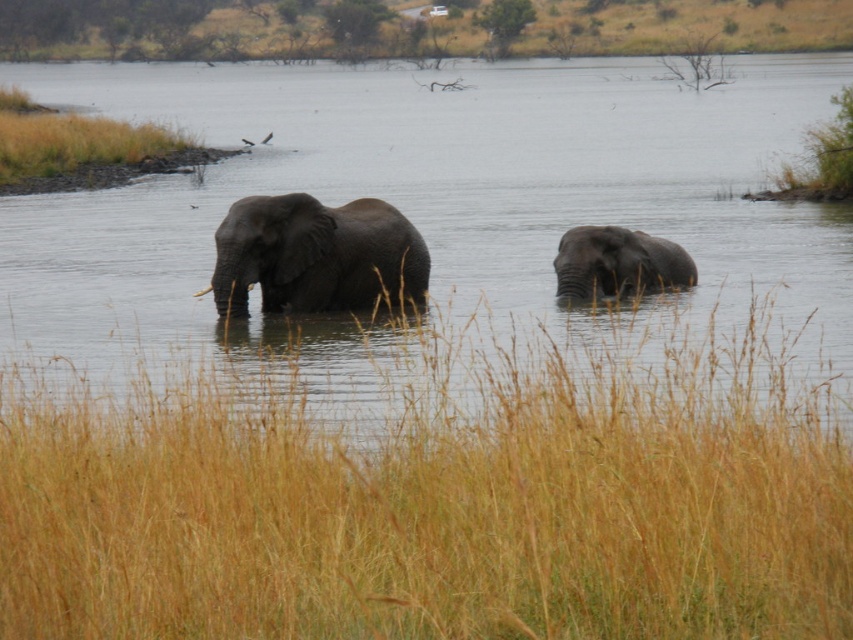
Which of these two, brown dry grass at left or gray matte elephant at right, stands taller?

Standing taller between the two is brown dry grass at left.

Does brown dry grass at left appear over gray matte elephant at right?

Yes.

Does point (28, 106) lie behind point (622, 230)?

Yes, it is behind point (622, 230).

Identify the location of brown dry grass at left. The width and height of the screenshot is (853, 640). (70, 140).

Can you confirm if brown dry grass at center is smaller than gray matte elephant at center?

Incorrect, brown dry grass at center is not smaller in size than gray matte elephant at center.

How distant is brown dry grass at center from gray matte elephant at center?

They are 8.14 meters apart.

Which is in front, point (663, 456) or point (242, 240)?

Point (663, 456) is in front.

Where is `brown dry grass at center`? brown dry grass at center is located at coordinates (434, 515).

Between brown dry grass at center and brown dry grass at left, which one has less height?

brown dry grass at center is shorter.

Does brown dry grass at center come behind brown dry grass at left?

No, brown dry grass at center is in front of brown dry grass at left.

Who is more forward, (445, 413) or (9, 144)?

Point (445, 413) is more forward.

Locate an element on the screen. The width and height of the screenshot is (853, 640). brown dry grass at center is located at coordinates (434, 515).